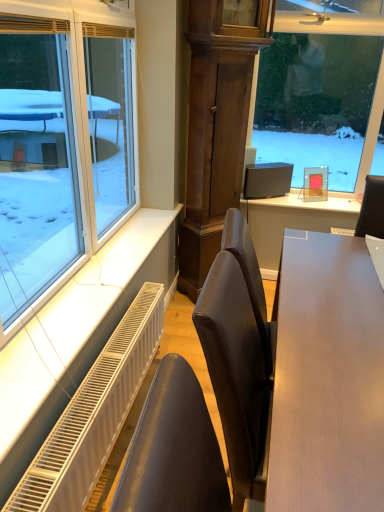
Question: Considering the positions of light brown wooden table at center and satin black monitor at upper center in the image, is light brown wooden table at center taller or shorter than satin black monitor at upper center?

Choices:
 (A) short
 (B) tall

Answer: (B)

Question: From the image's perspective, is light brown wooden table at center located above or below satin black monitor at upper center?

Choices:
 (A) below
 (B) above

Answer: (A)

Question: Which object is the closest to the clear glass window at left?

Choices:
 (A) light brown wooden table at center
 (B) white metal radiator at lower left
 (C) satin black monitor at upper center

Answer: (B)

Question: Which object is the farthest from the clear glass window at left?

Choices:
 (A) light brown wooden table at center
 (B) satin black monitor at upper center
 (C) white metal radiator at lower left

Answer: (A)